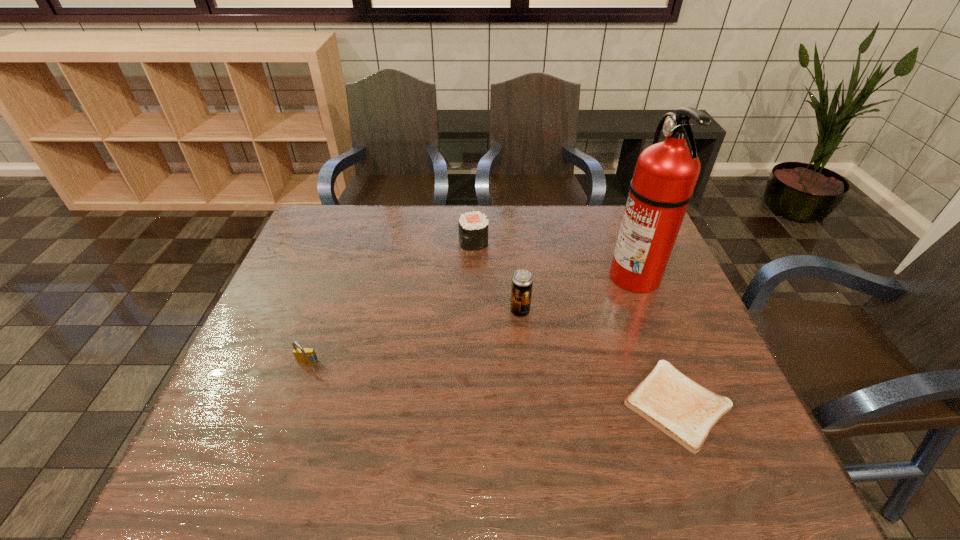
Identify the location of fire extinguisher. (666, 173).

Identify the location of the third object from left to right. This screenshot has width=960, height=540. (522, 281).

You are a GUI agent. You are given a task and a screenshot of the screen. Output one action in this format:
    pyautogui.click(x=<x>, y=<y>)
    Task: Click on the beer can
    The image size is (960, 540).
    Given the screenshot: What is the action you would take?
    pyautogui.click(x=522, y=281)

You are a GUI agent. You are given a task and a screenshot of the screen. Output one action in this format:
    pyautogui.click(x=<x>, y=<y>)
    Task: Click on the fourth object from right to left
    
    Given the screenshot: What is the action you would take?
    pyautogui.click(x=473, y=227)

At what (x,y) coordinates should I click in order to perform the action: click on the leftmost object. Please return your answer as a coordinate pair (x, y). The width and height of the screenshot is (960, 540). Looking at the image, I should click on (303, 355).

Where is `toast`? toast is located at coordinates (685, 411).

Locate an element on the screen. This screenshot has height=540, width=960. vacant area situated 0.050m at the nozzle of the fire extinguisher is located at coordinates (591, 275).

Locate an element on the screen. blank space located at the nozzle of the fire extinguisher is located at coordinates (486, 275).

At what (x,y) coordinates should I click in order to perform the action: click on free region located 0.080m at the nozzle of the fire extinguisher. Please return your answer as a coordinate pair (x, y). Looking at the image, I should click on (582, 275).

Locate an element on the screen. vacant space located on the back of the third object from right to left is located at coordinates (516, 264).